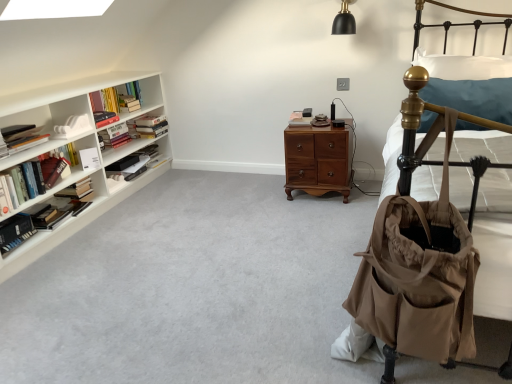
Question: Can you confirm if white soft pillow at upper right is bigger than white matte book at center, which ranks as the tenth book in left-to-right order?

Choices:
 (A) yes
 (B) no

Answer: (A)

Question: From the image's perspective, is white soft pillow at upper right beneath white matte book at center, which is the first book from right to left?

Choices:
 (A) yes
 (B) no

Answer: (B)

Question: Is white soft pillow at upper right shorter than white matte book at center, which ranks as the tenth book in left-to-right order?

Choices:
 (A) no
 (B) yes

Answer: (A)

Question: From a real-world perspective, is white soft pillow at upper right physically below white matte book at center, which ranks as the tenth book in left-to-right order?

Choices:
 (A) yes
 (B) no

Answer: (B)

Question: Are white soft pillow at upper right and white matte book at center, which is the first book from right to left, located far from each other?

Choices:
 (A) no
 (B) yes

Answer: (A)

Question: From a real-world perspective, relative to hardcover book at left, the 3th book from the left, is hardcover book at left, which ranks as the fifth book in right-to-left order, vertically above or below?

Choices:
 (A) above
 (B) below

Answer: (A)

Question: From the image's perspective, is hardcover book at left, which ranks as the fifth book in right-to-left order, above or below hardcover book at left, the 3th book from the left?

Choices:
 (A) below
 (B) above

Answer: (B)

Question: In terms of width, does hardcover book at left, which ranks as the fifth book in right-to-left order, look wider or thinner when compared to hardcover book at left, which is the 8th book in right-to-left order?

Choices:
 (A) wide
 (B) thin

Answer: (B)

Question: From their relative heights in the image, would you say hardcover book at left, which ranks as the fifth book in right-to-left order, is taller or shorter than hardcover book at left, which is the 8th book in right-to-left order?

Choices:
 (A) tall
 (B) short

Answer: (B)

Question: Is white soft pillow at upper right taller or shorter than tan fabric baby carriage at right?

Choices:
 (A) short
 (B) tall

Answer: (A)

Question: From the image's perspective, is white soft pillow at upper right above or below tan fabric baby carriage at right?

Choices:
 (A) below
 (B) above

Answer: (B)

Question: Considering the positions of white soft pillow at upper right and tan fabric baby carriage at right in the image, is white soft pillow at upper right wider or thinner than tan fabric baby carriage at right?

Choices:
 (A) thin
 (B) wide

Answer: (B)

Question: From a real-world perspective, is white soft pillow at upper right above or below tan fabric baby carriage at right?

Choices:
 (A) above
 (B) below

Answer: (A)

Question: From their relative heights in the image, would you say hardcover book at left, which ranks as the fourth book in left-to-right order, is taller or shorter than white soft pillow at upper right?

Choices:
 (A) short
 (B) tall

Answer: (A)

Question: Is point click(69, 193) closer or farther from the camera than point click(446, 71)?

Choices:
 (A) farther
 (B) closer

Answer: (A)